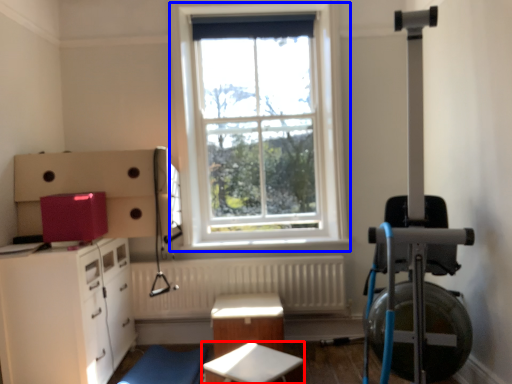
Question: Among these objects, which one is nearest to the camera, table (highlighted by a red box) or window (highlighted by a blue box)?

Choices:
 (A) table
 (B) window

Answer: (A)